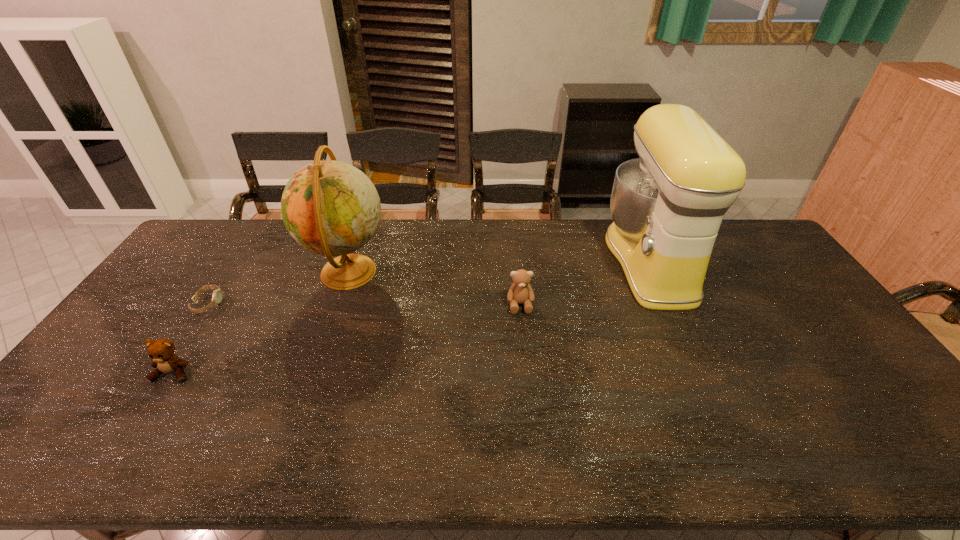
Find the location of a particular element. vacant space at the far right corner of the desktop is located at coordinates (732, 230).

What are the coordinates of `free space between the globe and the nearer teddy bear` in the screenshot? It's located at (261, 322).

This screenshot has height=540, width=960. What are the coordinates of `free space between the farther teddy bear and the globe` in the screenshot? It's located at (435, 288).

Image resolution: width=960 pixels, height=540 pixels. Identify the location of vacant space that's between the third object from left to right and the mixer. (499, 267).

Locate an element on the screen. free space between the third object from left to right and the nearer teddy bear is located at coordinates (261, 322).

At what (x,y) coordinates should I click in order to perform the action: click on free space between the rightmost object and the fourth object from left to right. Please return your answer as a coordinate pair (x, y). This screenshot has width=960, height=540. Looking at the image, I should click on (585, 283).

At what (x,y) coordinates should I click in order to perform the action: click on vacant region between the watch and the globe. Please return your answer as a coordinate pair (x, y). The height and width of the screenshot is (540, 960). Looking at the image, I should click on (278, 288).

Locate an element on the screen. The width and height of the screenshot is (960, 540). unoccupied position between the right teddy bear and the globe is located at coordinates (435, 288).

You are a GUI agent. You are given a task and a screenshot of the screen. Output one action in this format:
    pyautogui.click(x=<x>, y=<y>)
    Task: Click on the free space between the rightmost object and the shortest object
    The height and width of the screenshot is (540, 960).
    Given the screenshot: What is the action you would take?
    pyautogui.click(x=429, y=282)

You are a GUI agent. You are given a task and a screenshot of the screen. Output one action in this format:
    pyautogui.click(x=<x>, y=<y>)
    Task: Click on the vacant area that lies between the second object from right to left and the shortest object
    Image resolution: width=960 pixels, height=540 pixels.
    Given the screenshot: What is the action you would take?
    pyautogui.click(x=364, y=304)